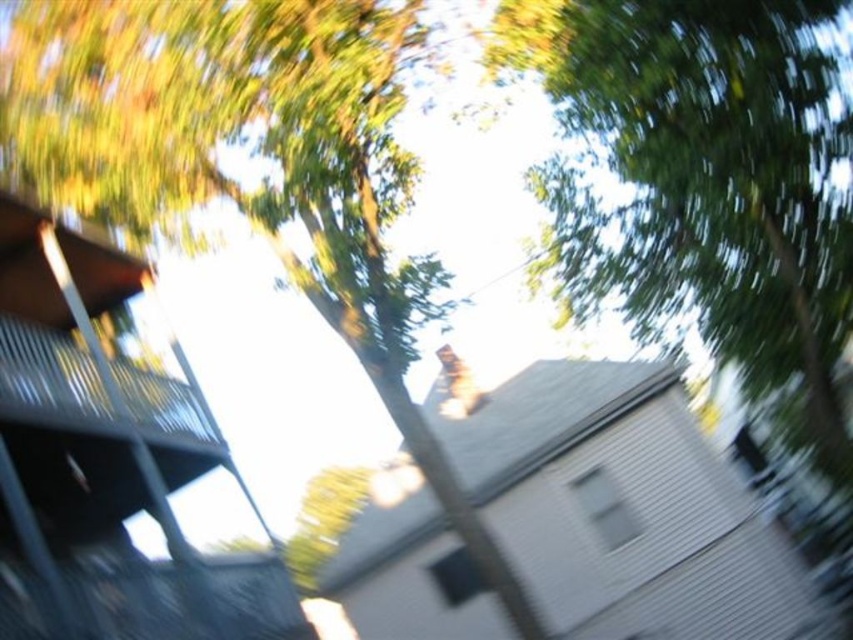
Is point (351, 77) positioned before point (167, 394)?

Yes, point (351, 77) is closer to viewer.

Image resolution: width=853 pixels, height=640 pixels. I want to click on green leafy tree at upper center, so click(x=259, y=154).

Describe the element at coordinates (259, 154) in the screenshot. I see `green leafy tree at upper center` at that location.

This screenshot has height=640, width=853. Find the location of `green leafy tree at upper center`. green leafy tree at upper center is located at coordinates (259, 154).